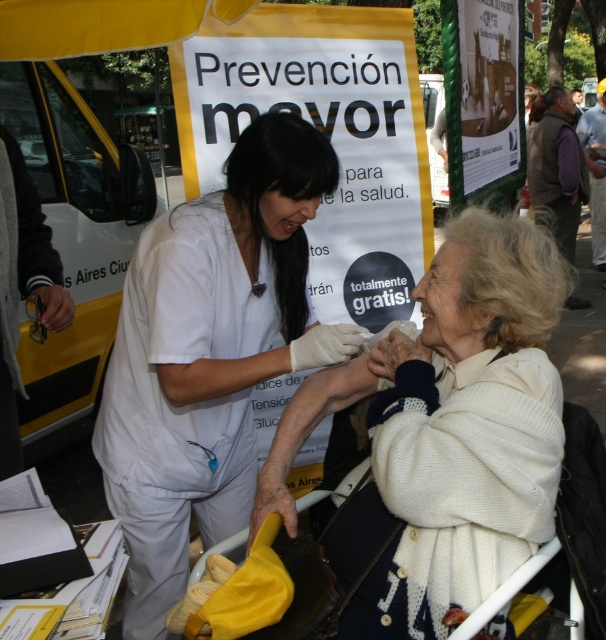
You are a photographer at the event and need to capture a closeup shot of both the white knitted sweater at center and the white matte uniform at center without any part of them being cut off. What is the minimum distance in inches you should keep between the camera and the subjects to ensure both are fully in frame?

The minimum distance required is 14.10 inches because the white knitted sweater at center and the white matte uniform at center are 14.10 inches apart, so the camera must be at least that distance away to include both in the frame.

What is the relationship between the width of the white knitted sweater at center and the white matte uniform at center?

The white knitted sweater at center is wider than the white matte uniform at center.